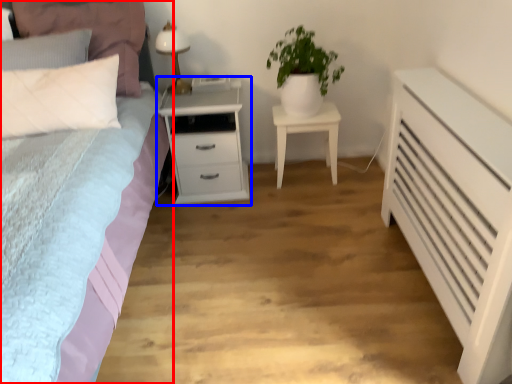
Question: Which point is closer to the camera, bed (highlighted by a red box) or nightstand (highlighted by a blue box)?

Choices:
 (A) bed
 (B) nightstand

Answer: (A)